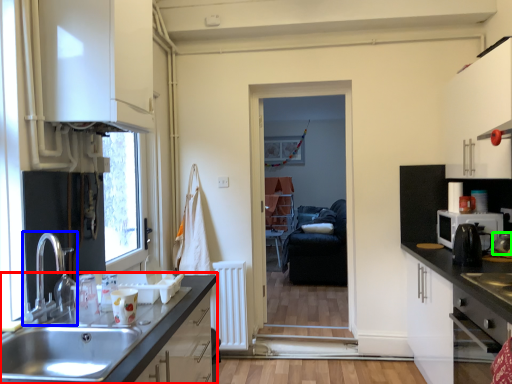
Question: Estimate the real-world distances between objects in this image. Which object is closer to countertop (highlighted by a red box), tap (highlighted by a blue box) or appliance (highlighted by a green box)?

Choices:
 (A) tap
 (B) appliance

Answer: (A)